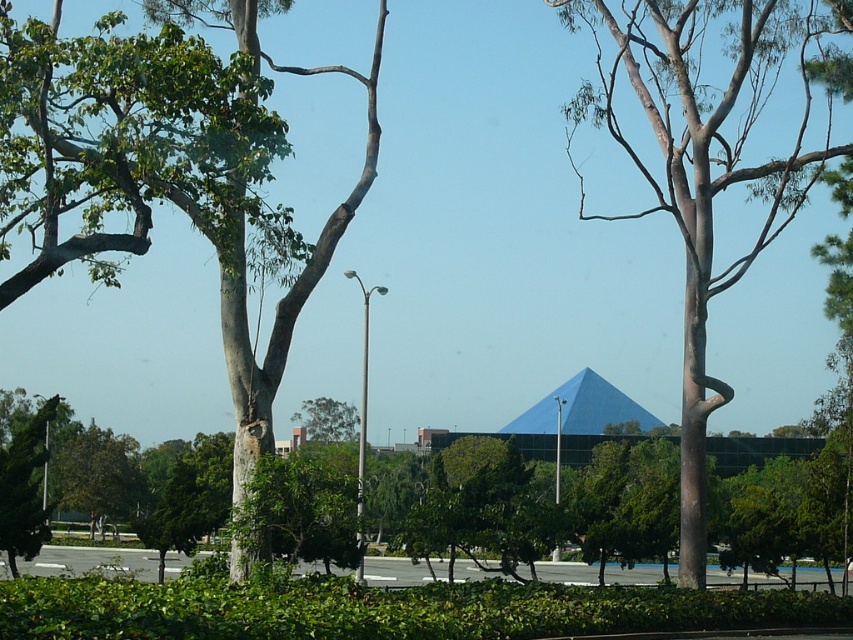
Question: Observing the image, what is the correct spatial positioning of green rough bark tree at left in reference to brown textured tree at center?

Choices:
 (A) below
 (B) above

Answer: (A)

Question: Does green rough bark tree at left appear on the left side of brown textured tree at center?

Choices:
 (A) no
 (B) yes

Answer: (B)

Question: Is green rough bark tree at left to the left of brown textured tree at center from the viewer's perspective?

Choices:
 (A) yes
 (B) no

Answer: (A)

Question: Which point is closer to the camera?

Choices:
 (A) green rough bark tree at left
 (B) brown textured tree at center

Answer: (A)

Question: Which object appears farthest from the camera in this image?

Choices:
 (A) brown textured tree at center
 (B) green rough bark tree at left

Answer: (A)